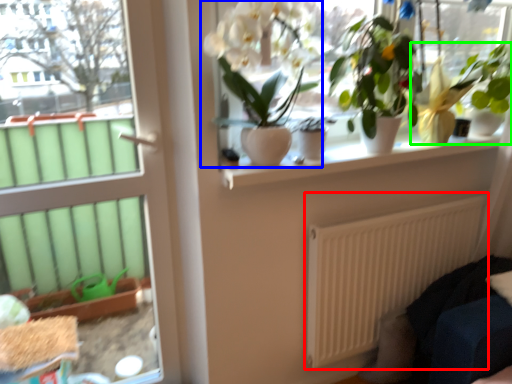
Question: Considering the real-world distances, which object is closest to radiator (highlighted by a red box)? houseplant (highlighted by a blue box) or houseplant (highlighted by a green box).

Choices:
 (A) houseplant
 (B) houseplant

Answer: (B)